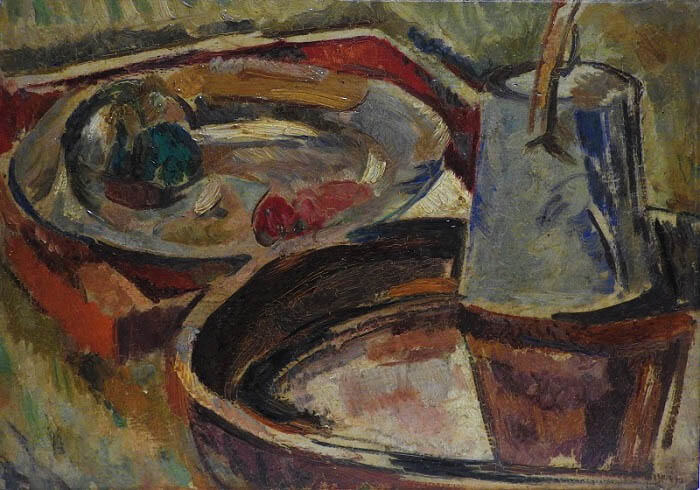
The width and height of the screenshot is (700, 490). Find the location of `tray`. tray is located at coordinates (85, 413).